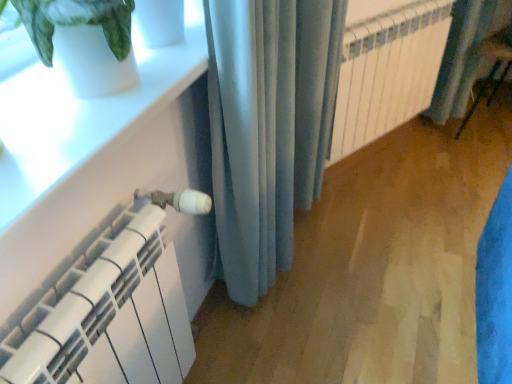
Question: Is blue fabric curtain at right, which is the 2th curtain from left to right, located outside satin blue curtain at center, the second curtain in the back-to-front sequence?

Choices:
 (A) no
 (B) yes

Answer: (B)

Question: From a real-world perspective, is blue fabric curtain at right, which is the 1th curtain from right to left, below satin blue curtain at center, which appears as the first curtain when viewed from the left?

Choices:
 (A) yes
 (B) no

Answer: (A)

Question: Is blue fabric curtain at right, which is the 1th curtain from right to left, beside satin blue curtain at center, which appears as the first curtain when viewed from the left?

Choices:
 (A) yes
 (B) no

Answer: (B)

Question: Is blue fabric curtain at right, which is the 2th curtain from left to right, positioned before satin blue curtain at center, the second curtain in the right-to-left sequence?

Choices:
 (A) no
 (B) yes

Answer: (A)

Question: Is blue fabric curtain at right, marked as the 2th curtain in a front-to-back arrangement, positioned behind satin blue curtain at center, which appears as the first curtain when viewed from the left?

Choices:
 (A) yes
 (B) no

Answer: (A)

Question: From a real-world perspective, is blue fabric curtain at right, which is the 1th curtain from right to left, on satin blue curtain at center, which appears as the first curtain when viewed from the left?

Choices:
 (A) no
 (B) yes

Answer: (A)

Question: Does white metallic radiator at center appear on the right side of blue fabric curtain at right, which is the 1th curtain from back to front?

Choices:
 (A) no
 (B) yes

Answer: (A)

Question: From a real-world perspective, is white metallic radiator at center located higher than blue fabric curtain at right, which is the 2th curtain from left to right?

Choices:
 (A) no
 (B) yes

Answer: (B)

Question: Is white metallic radiator at center far away from blue fabric curtain at right, marked as the 2th curtain in a front-to-back arrangement?

Choices:
 (A) yes
 (B) no

Answer: (B)

Question: Is the surface of white metallic radiator at center in direct contact with blue fabric curtain at right, which is the 1th curtain from right to left?

Choices:
 (A) no
 (B) yes

Answer: (A)

Question: Can you confirm if white metallic radiator at center is wider than blue fabric curtain at right, which is the 1th curtain from back to front?

Choices:
 (A) yes
 (B) no

Answer: (B)

Question: Is white metallic radiator at center positioned beyond the bounds of blue fabric curtain at right, marked as the 2th curtain in a front-to-back arrangement?

Choices:
 (A) no
 (B) yes

Answer: (B)

Question: Could white metallic radiator at center be considered to be inside white glossy window sill at upper left?

Choices:
 (A) yes
 (B) no

Answer: (B)